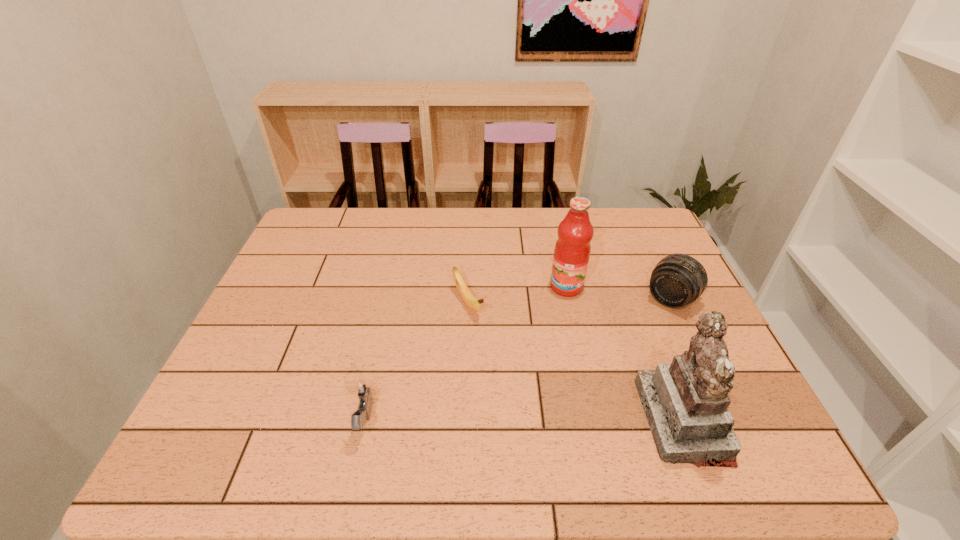
Where is `the fourth tallest object`? The height and width of the screenshot is (540, 960). the fourth tallest object is located at coordinates (364, 389).

Where is `the leftmost object`? the leftmost object is located at coordinates (364, 389).

Image resolution: width=960 pixels, height=540 pixels. In order to click on figurine in this screenshot , I will do `click(686, 402)`.

Identify the location of the third tallest object. (677, 280).

At what (x,y) coordinates should I click in order to perform the action: click on banana. Please return your answer as a coordinate pair (x, y). The height and width of the screenshot is (540, 960). Looking at the image, I should click on (471, 301).

I want to click on the fourth object from right to left, so click(471, 301).

This screenshot has width=960, height=540. I want to click on the third object from right to left, so click(572, 250).

This screenshot has width=960, height=540. Find the location of `free space located 0.090m on the left of the leftmost object`. free space located 0.090m on the left of the leftmost object is located at coordinates (308, 422).

The image size is (960, 540). In order to click on blank space located on the front-facing side of the figurine in this screenshot , I will do `click(556, 420)`.

You are a GUI agent. You are given a task and a screenshot of the screen. Output one action in this format:
    pyautogui.click(x=<x>, y=<y>)
    Task: Click on the vacant space located on the front-facing side of the figurine
    
    Given the screenshot: What is the action you would take?
    pyautogui.click(x=575, y=420)